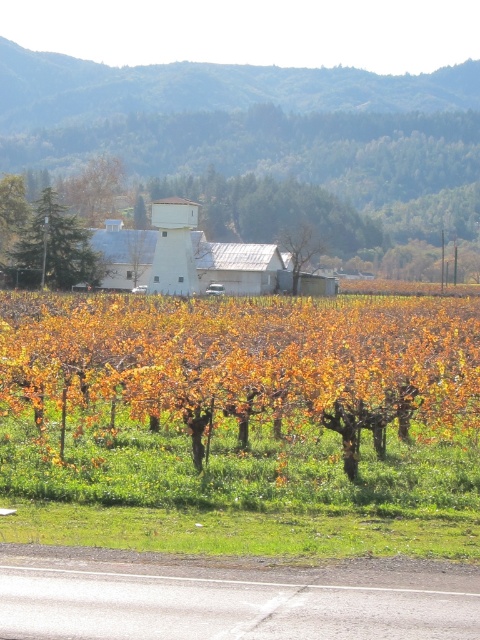
You are standing in the vineyard looking towards the winery. There are two points marked in the image. Which point, point (81, 241) or point (8, 193), is closer to you?

Point (81, 241) is closer to the viewer than point (8, 193).

You are standing in the vineyard and want to take a photo of the green textured pine tree at upper left. If your camera can focus on objects up to 100 meters away, will you be able to capture a clear image of the tree?

The green textured pine tree at upper left is 84.44 meters from viewer, which is within the camera focus range of up to 100 meters. Therefore, you can capture a clear image of the tree.